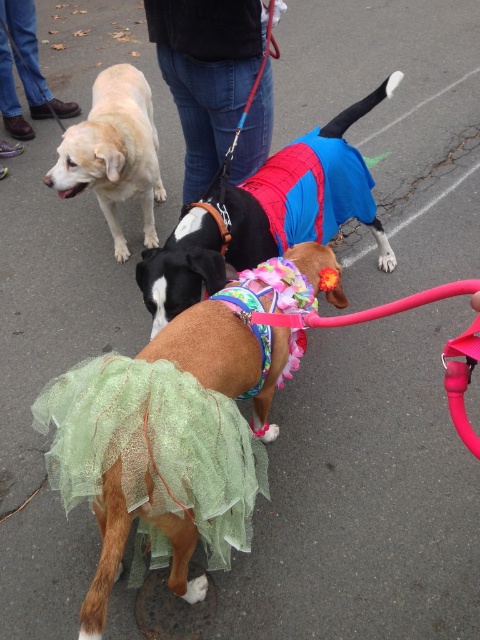
Based on the photo, between green tulle ballet skirt at center and shiny blue coat at center, which one has less height?

green tulle ballet skirt at center

Which is behind, point (43, 422) or point (292, 157)?

Positioned behind is point (292, 157).

Locate an element on the screen. The height and width of the screenshot is (640, 480). green tulle ballet skirt at center is located at coordinates (155, 445).

Can you confirm if green tulle skirt at center is positioned above jeans at center?

No, green tulle skirt at center is not above jeans at center.

Which is below, green tulle skirt at center or jeans at center?

green tulle skirt at center

Identify the location of green tulle skirt at center. (166, 442).

Does shiny blue coat at center have a greater height compared to jeans at center?

Indeed, shiny blue coat at center has a greater height compared to jeans at center.

Can you confirm if shiny blue coat at center is bigger than jeans at center?

Indeed, shiny blue coat at center has a larger size compared to jeans at center.

At what (x,y) coordinates should I click in order to perform the action: click on shiny blue coat at center. Please return your answer as a coordinate pair (x, y). Image resolution: width=480 pixels, height=640 pixels. Looking at the image, I should click on (266, 216).

Find the location of a particular element. The image size is (480, 640). shiny blue coat at center is located at coordinates (266, 216).